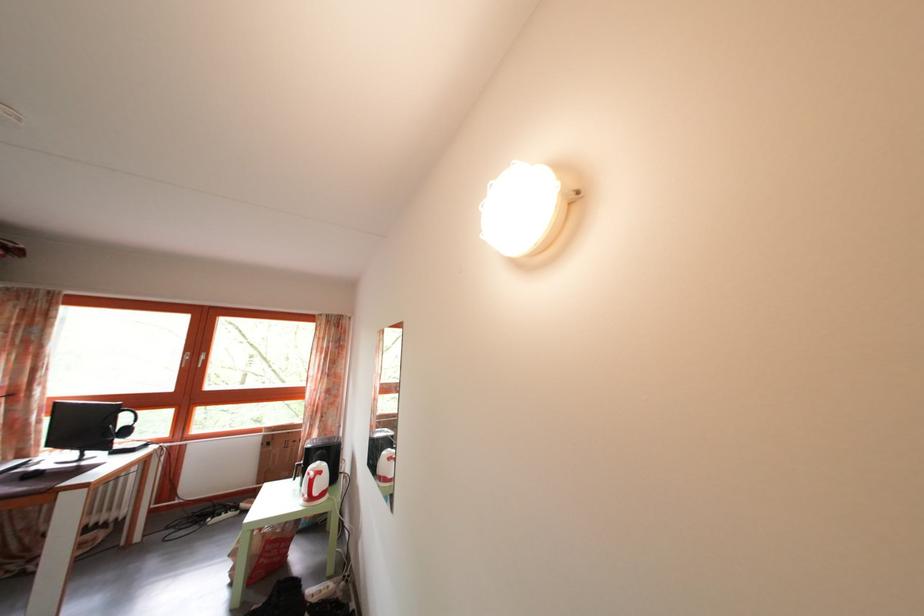
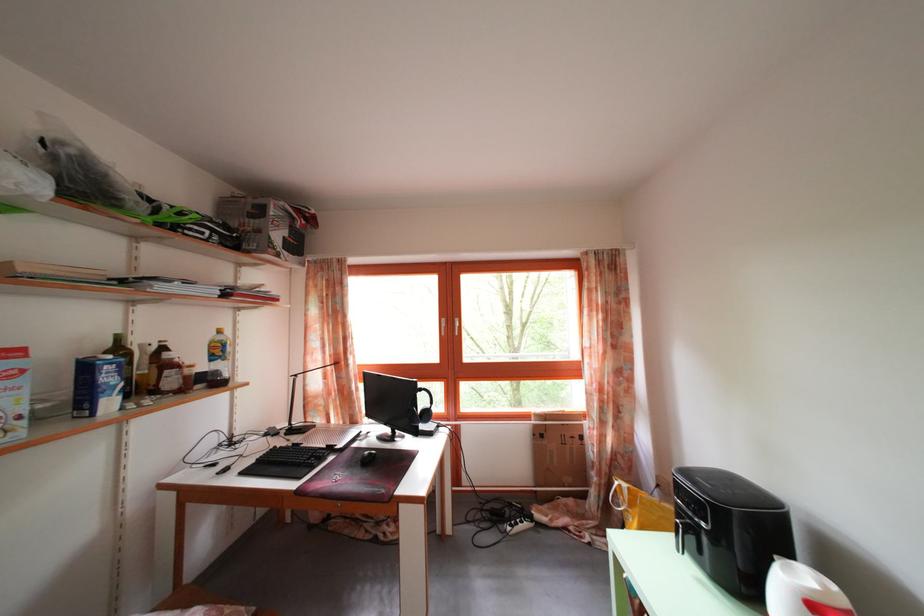
In the second image, find the point that corresponds to [272,445] in the first image.

(542, 432)